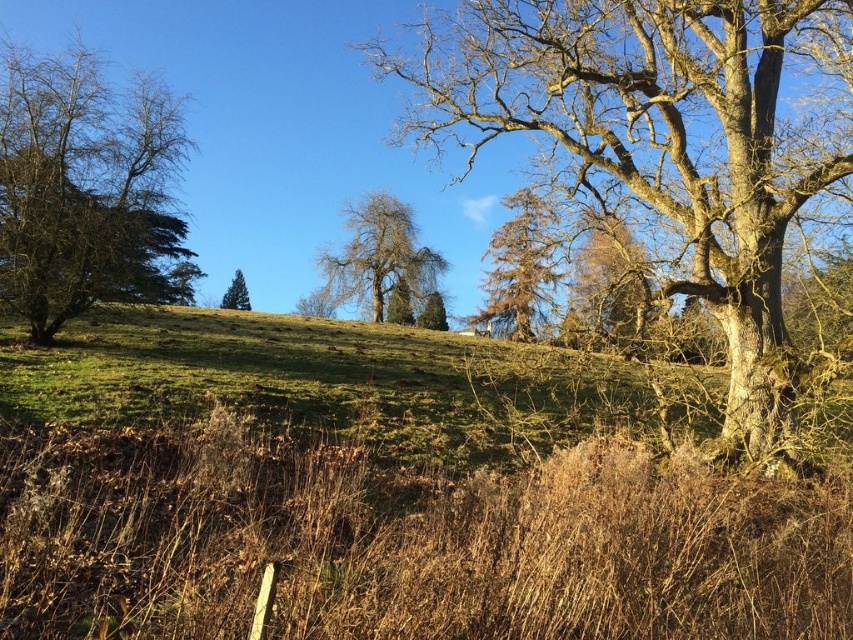
Does brown/scaly tree at center appear under brown rough tree at center?

No, brown/scaly tree at center is not below brown rough tree at center.

Is point (537, 259) behind point (308, 310)?

No, it is not.

The width and height of the screenshot is (853, 640). Find the location of `brown/scaly tree at center`. brown/scaly tree at center is located at coordinates (519, 268).

Can you confirm if brown rough bark tree at center is taller than brown/scaly tree at center?

No.

Is brown rough bark tree at center closer to camera compared to brown/scaly tree at center?

That is True.

Between point (602, 321) and point (529, 252), which one is positioned behind?

Point (529, 252)

Identify the location of brown rough bark tree at center. (607, 289).

Can you confirm if green leafy tree at left is taller than brown rough bark tree at center?

In fact, green leafy tree at left may be shorter than brown rough bark tree at center.

Is green leafy tree at left wider than brown rough bark tree at center?

Incorrect, green leafy tree at left's width does not surpass brown rough bark tree at center's.

The image size is (853, 640). What do you see at coordinates (83, 188) in the screenshot?
I see `green leafy tree at left` at bounding box center [83, 188].

The image size is (853, 640). I want to click on green leafy tree at left, so click(x=83, y=188).